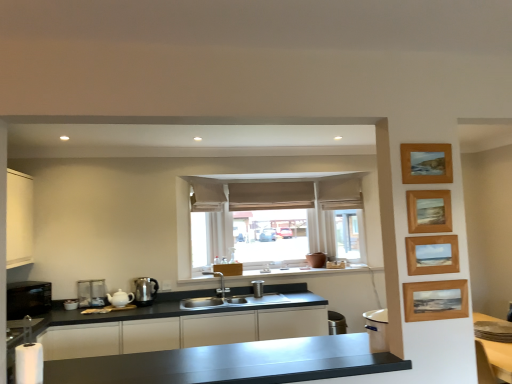
Question: From the image's perspective, is white matte cabinet at left, placed as the 1th cabinetry when sorted from top to bottom, on top of wooden picture frame at upper right, which is the second picture frame in top-to-bottom order?

Choices:
 (A) no
 (B) yes

Answer: (A)

Question: From a real-world perspective, is white matte cabinet at left, the 2th cabinetry positioned from the bottom, located higher than wooden picture frame at upper right, the 3th picture frame ordered from the bottom?

Choices:
 (A) no
 (B) yes

Answer: (B)

Question: Would you say white matte cabinet at left, placed as the 1th cabinetry when sorted from top to bottom, is outside wooden picture frame at upper right, which is the second picture frame in top-to-bottom order?

Choices:
 (A) no
 (B) yes

Answer: (B)

Question: Is white matte cabinet at left, the 2th cabinetry positioned from the right, to the right of wooden picture frame at upper right, which is the second picture frame in top-to-bottom order, from the viewer's perspective?

Choices:
 (A) no
 (B) yes

Answer: (A)

Question: Is white matte cabinet at left, placed as the 1th cabinetry when sorted from top to bottom, bigger than wooden picture frame at upper right, the 3th picture frame ordered from the bottom?

Choices:
 (A) no
 (B) yes

Answer: (B)

Question: From a real-world perspective, is wooden picture frame at upper right, which is counted as the fourth picture frame, starting from the bottom, positioned above or below white glossy window sill at center?

Choices:
 (A) above
 (B) below

Answer: (A)

Question: Would you say wooden picture frame at upper right, which is counted as the fourth picture frame, starting from the bottom, is inside or outside white glossy window sill at center?

Choices:
 (A) inside
 (B) outside

Answer: (B)

Question: Considering the relative positions of wooden picture frame at upper right, which is counted as the fourth picture frame, starting from the bottom, and white glossy window sill at center in the image provided, is wooden picture frame at upper right, which is counted as the fourth picture frame, starting from the bottom, to the left or to the right of white glossy window sill at center?

Choices:
 (A) left
 (B) right

Answer: (B)

Question: In terms of height, does wooden picture frame at upper right, the 1th picture frame from the top, look taller or shorter compared to white glossy window sill at center?

Choices:
 (A) short
 (B) tall

Answer: (B)

Question: From the image's perspective, is wooden picture frame at right, the third picture frame in the top-to-bottom sequence, above or below beige fabric curtain at upper center, which is counted as the 3th curtain, starting from the left?

Choices:
 (A) below
 (B) above

Answer: (A)

Question: Would you say wooden picture frame at right, the 2th picture frame in the bottom-to-top sequence, is to the left or to the right of beige fabric curtain at upper center, which is counted as the 3th curtain, starting from the left, in the picture?

Choices:
 (A) right
 (B) left

Answer: (B)

Question: Considering the positions of wooden picture frame at right, the third picture frame in the top-to-bottom sequence, and beige fabric curtain at upper center, which is the first curtain from right to left, in the image, is wooden picture frame at right, the third picture frame in the top-to-bottom sequence, taller or shorter than beige fabric curtain at upper center, which is the first curtain from right to left,?

Choices:
 (A) short
 (B) tall

Answer: (A)

Question: Looking at the image, does wooden picture frame at right, the 2th picture frame in the bottom-to-top sequence, seem bigger or smaller compared to beige fabric curtain at upper center, which is counted as the 3th curtain, starting from the left?

Choices:
 (A) small
 (B) big

Answer: (A)

Question: Considering the positions of point (172, 317) and point (137, 299), is point (172, 317) closer or farther from the camera than point (137, 299)?

Choices:
 (A) farther
 (B) closer

Answer: (B)

Question: In terms of height, does satin black countertop at center, arranged as the 1th cabinetry when viewed from the right, look taller or shorter compared to satin silver kettle at lower left, the second appliance when ordered from left to right?

Choices:
 (A) tall
 (B) short

Answer: (A)